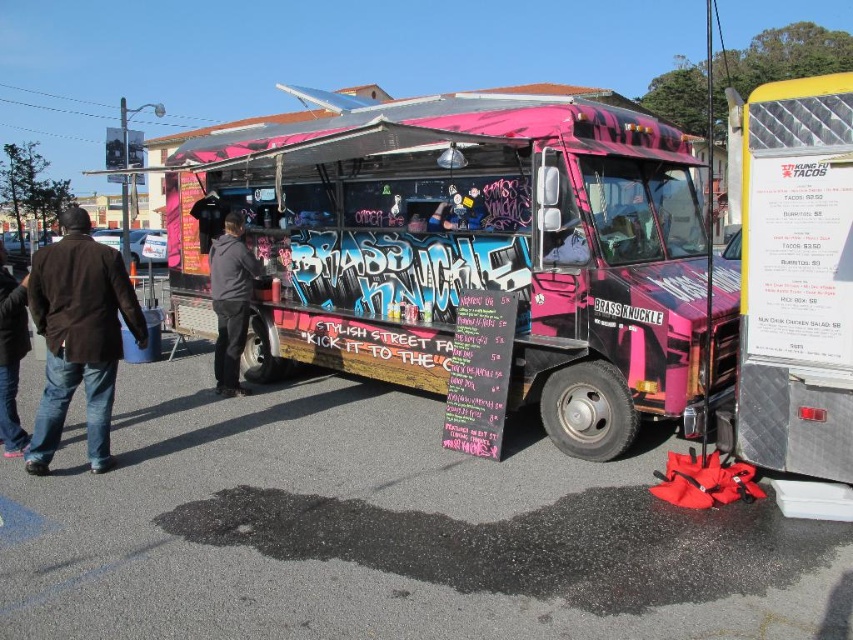
Can you confirm if black matte jacket at center is positioned above jeans at left?

No, black matte jacket at center is not above jeans at left.

Measure the distance between point (219,294) and camera.

Point (219,294) and camera are 7.70 meters apart.

You are a GUI agent. You are given a task and a screenshot of the screen. Output one action in this format:
    pyautogui.click(x=<x>, y=<y>)
    Task: Click on the black matte jacket at center
    The image size is (853, 640).
    Given the screenshot: What is the action you would take?
    pyautogui.click(x=230, y=300)

Which is below, brown leather jacket at left or jeans at left?

Positioned lower is brown leather jacket at left.

Locate an element on the screen. brown leather jacket at left is located at coordinates click(x=79, y=336).

This screenshot has width=853, height=640. Find the location of `brown leather jacket at left`. brown leather jacket at left is located at coordinates (79, 336).

In order to click on brown leather jacket at left in this screenshot , I will do `click(79, 336)`.

Is brown leather jacket at left smaller than black matte jacket at center?

Yes, brown leather jacket at left is smaller than black matte jacket at center.

Is point (103, 468) behind point (250, 276)?

No, it is not.

Identify the location of brown leather jacket at left. (79, 336).